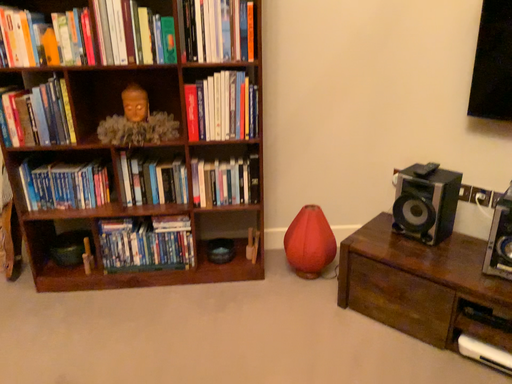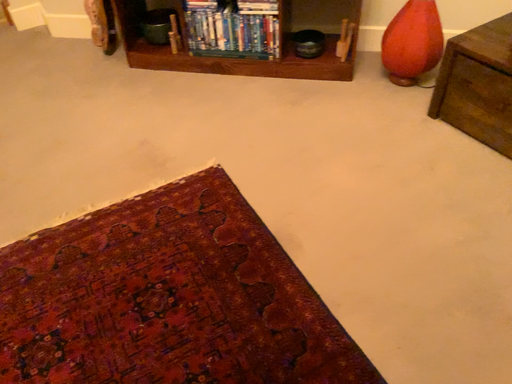
Question: How did the camera likely rotate when shooting the video?

Choices:
 (A) rotated downward
 (B) rotated upward

Answer: (A)